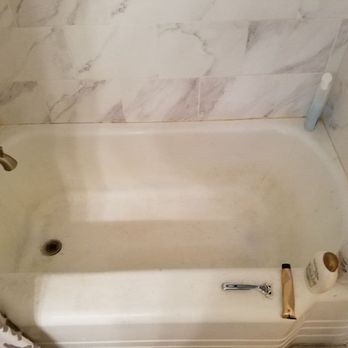
The height and width of the screenshot is (348, 348). Identify the location of wall. (207, 62).